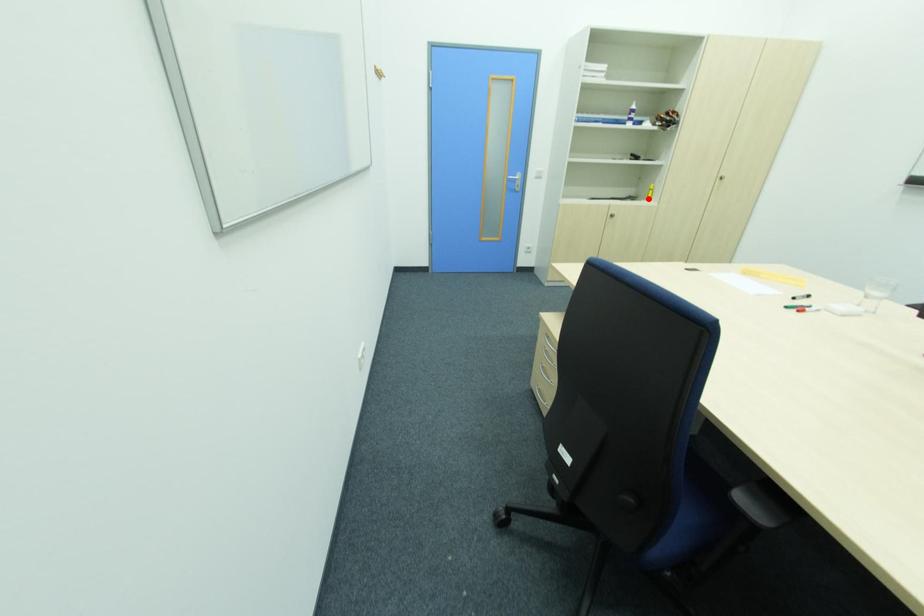
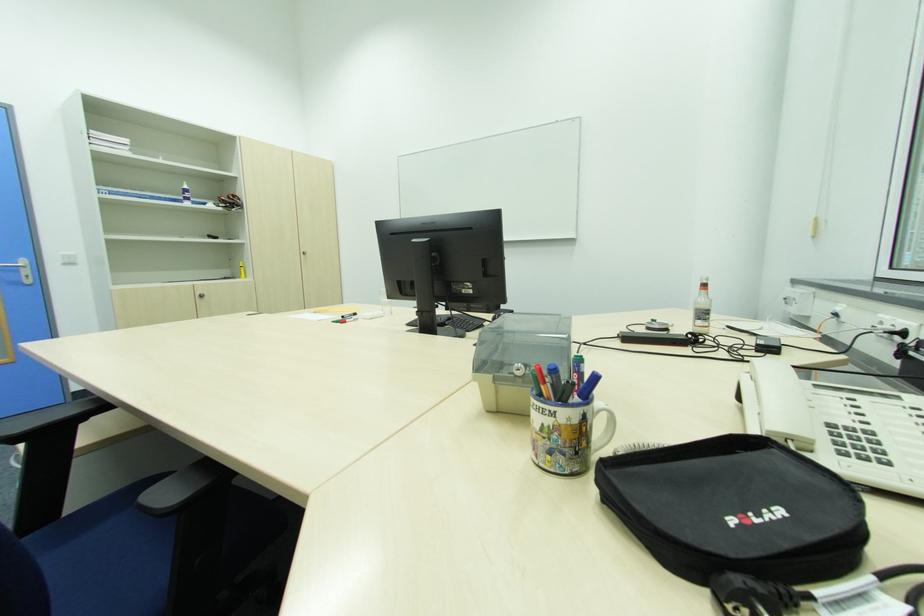
Question: I am providing you with two images of the same scene from different viewpoints. In image1, a red point is highlighted. Considering the same 3D point in image2, which of the following is correct?

Choices:
 (A) It is closer
 (B) It is farther

Answer: (B)